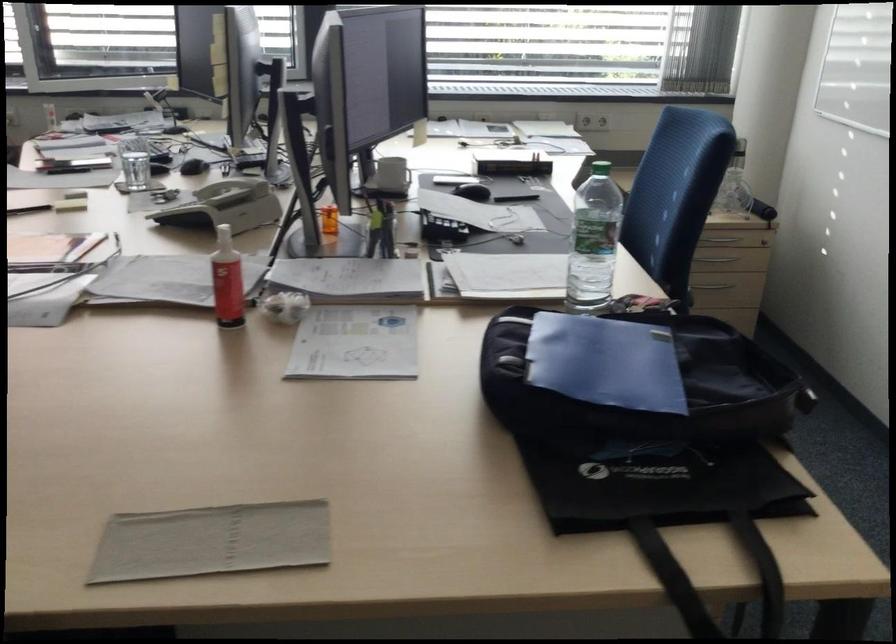
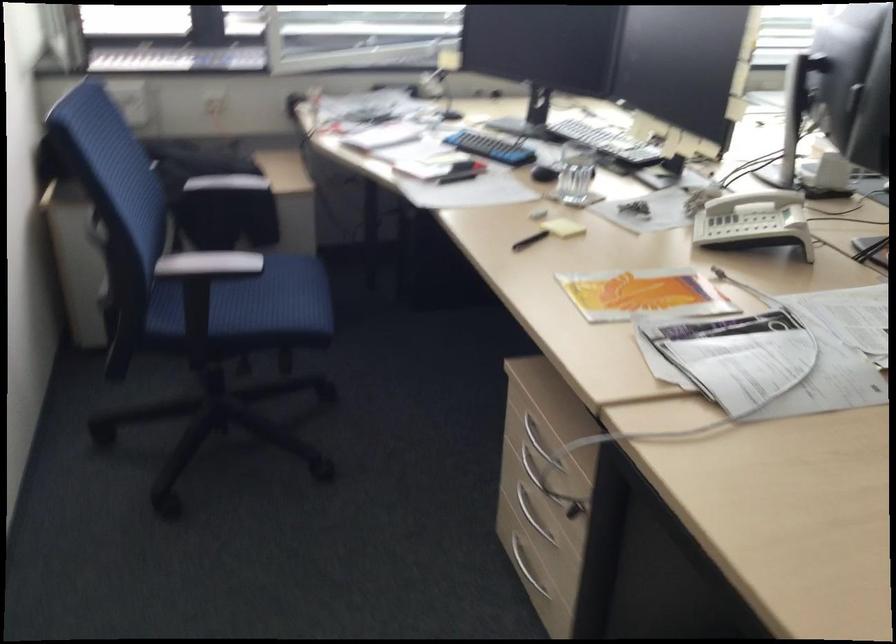
Where in the second image is the point corresponding to [197,205] from the first image?

(751, 225)